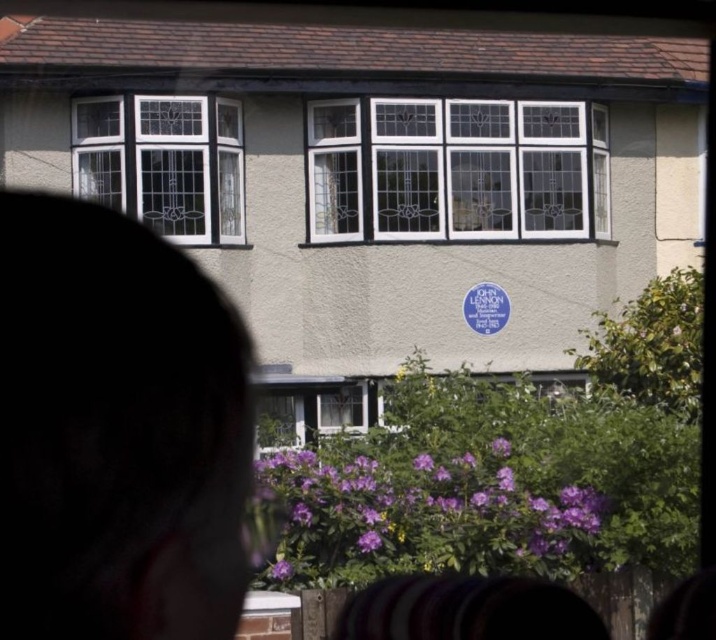
Can you confirm if silhouette hair at center is bigger than clear glass windows at center?

No.

Describe the element at coordinates (116, 432) in the screenshot. I see `silhouette hair at center` at that location.

Is point (137, 552) in front of point (342, 204)?

Yes, point (137, 552) is closer to viewer.

The image size is (716, 640). Identify the location of silhouette hair at center. (116, 432).

Between clear glass windows at center and white glass window at left, which one has more height?

clear glass windows at center

Who is more distant from viewer, (513,148) or (150,160)?

Point (513,148)

Locate an element on the screen. Image resolution: width=716 pixels, height=640 pixels. clear glass windows at center is located at coordinates (458, 170).

Where is `clear glass windows at center`? This screenshot has width=716, height=640. clear glass windows at center is located at coordinates (458, 170).

Is silhouette hair at center positioned at the back of white glass window at left?

No, silhouette hair at center is in front of white glass window at left.

Locate an element on the screen. This screenshot has height=640, width=716. silhouette hair at center is located at coordinates (116, 432).